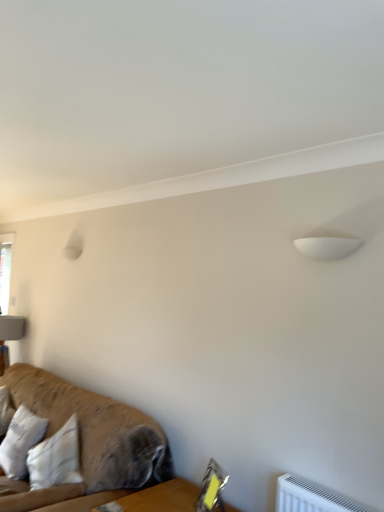
Question: From the image's perspective, would you say textured brown fabric couch at lower left is shown under white cotton pillow at lower left?

Choices:
 (A) yes
 (B) no

Answer: (B)

Question: From a real-world perspective, is textured brown fabric couch at lower left under white cotton pillow at lower left?

Choices:
 (A) yes
 (B) no

Answer: (B)

Question: Is textured brown fabric couch at lower left behind white cotton pillow at lower left?

Choices:
 (A) no
 (B) yes

Answer: (A)

Question: Is textured brown fabric couch at lower left not near white cotton pillow at lower left?

Choices:
 (A) no
 (B) yes

Answer: (A)

Question: Is textured brown fabric couch at lower left aimed at white cotton pillow at lower left?

Choices:
 (A) yes
 (B) no

Answer: (A)

Question: Is textured brown fabric couch at lower left closer to the viewer compared to white cotton pillow at lower left?

Choices:
 (A) yes
 (B) no

Answer: (A)

Question: Is white cotton pillow at lower left at the left side of textured brown fabric couch at lower left?

Choices:
 (A) yes
 (B) no

Answer: (A)

Question: Can you confirm if white cotton pillow at lower left is shorter than textured brown fabric couch at lower left?

Choices:
 (A) yes
 (B) no

Answer: (A)

Question: Considering the relative sizes of white cotton pillow at lower left and textured brown fabric couch at lower left in the image provided, is white cotton pillow at lower left wider than textured brown fabric couch at lower left?

Choices:
 (A) no
 (B) yes

Answer: (A)

Question: Is white cotton pillow at lower left completely or partially outside of textured brown fabric couch at lower left?

Choices:
 (A) yes
 (B) no

Answer: (A)

Question: Considering the relative sizes of white cotton pillow at lower left and textured brown fabric couch at lower left in the image provided, is white cotton pillow at lower left smaller than textured brown fabric couch at lower left?

Choices:
 (A) no
 (B) yes

Answer: (B)

Question: Does white cotton pillow at lower left have a greater height compared to textured brown fabric couch at lower left?

Choices:
 (A) no
 (B) yes

Answer: (A)

Question: Considering their positions, is white cotton pillow at lower left located in front of or behind textured brown fabric couch at lower left?

Choices:
 (A) behind
 (B) front

Answer: (A)